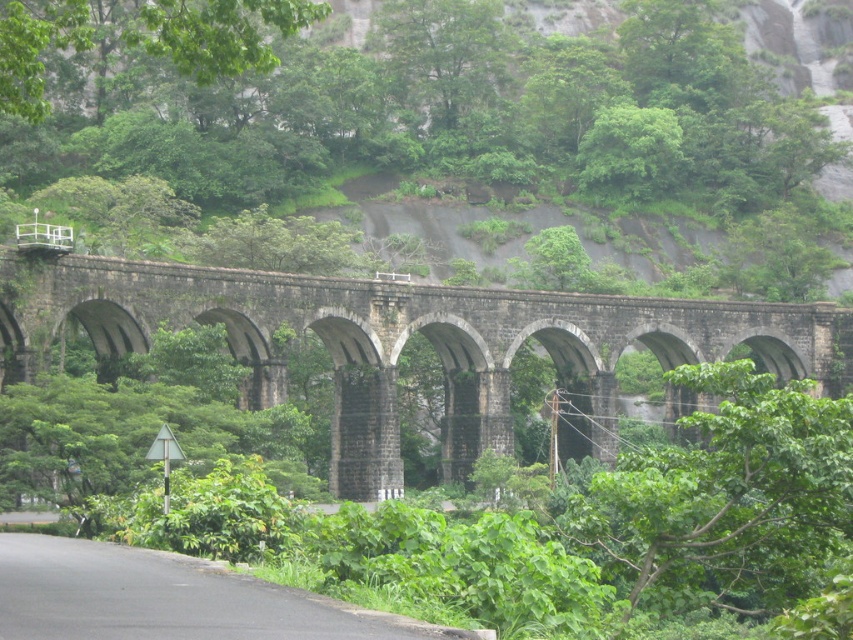
Based on the photo, which of these two, dark gray stone bridge at center or green leafy tree at upper center, stands shorter?

dark gray stone bridge at center is shorter.

Image resolution: width=853 pixels, height=640 pixels. Describe the element at coordinates (404, 342) in the screenshot. I see `dark gray stone bridge at center` at that location.

Does point (566, 388) lie in front of point (148, 38)?

No, it is not.

Locate an element on the screen. dark gray stone bridge at center is located at coordinates point(404,342).